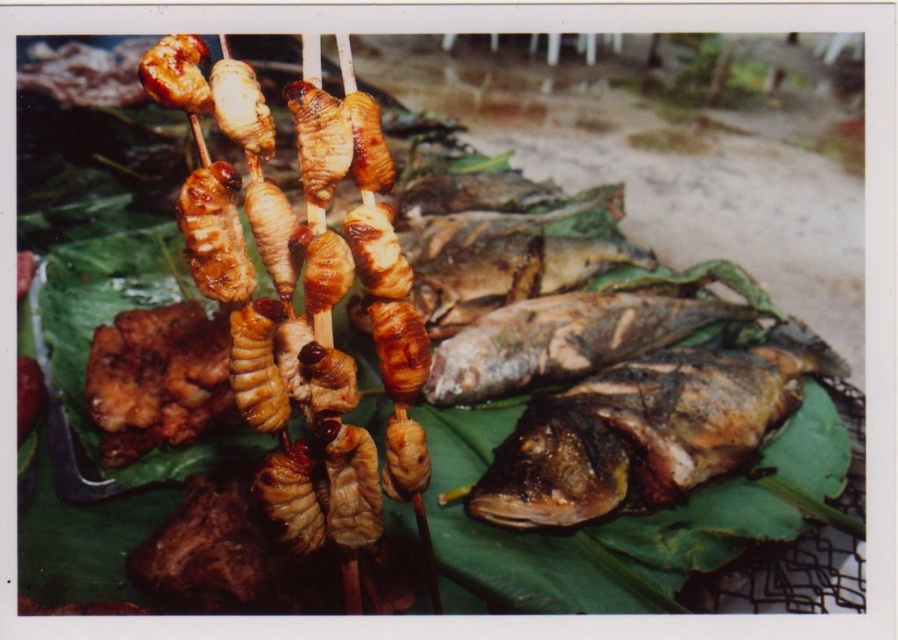
Between golden-brown crispy fish at center and brownish matte fish at center, which one is positioned higher?

brownish matte fish at center is higher up.

Who is positioned more to the left, golden-brown crispy fish at center or brownish matte fish at center?

Positioned to the left is brownish matte fish at center.

What do you see at coordinates (648, 429) in the screenshot? This screenshot has width=898, height=640. I see `golden-brown crispy fish at center` at bounding box center [648, 429].

The height and width of the screenshot is (640, 898). In order to click on golden-brown crispy fish at center in this screenshot , I will do `click(648, 429)`.